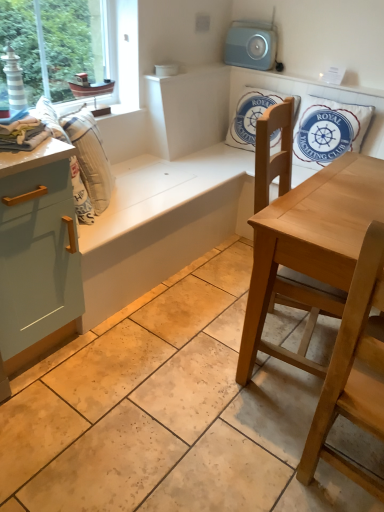
Question: Considering the relative positions of light wood chair at lower right, marked as the 1th chair in a front-to-back arrangement, and white striped fabric at left in the image provided, is light wood chair at lower right, marked as the 1th chair in a front-to-back arrangement, to the left of white striped fabric at left from the viewer's perspective?

Choices:
 (A) no
 (B) yes

Answer: (A)

Question: Does light wood chair at lower right, marked as the 1th chair in a front-to-back arrangement, have a lesser width compared to white striped fabric at left?

Choices:
 (A) no
 (B) yes

Answer: (A)

Question: Is there a large distance between light wood chair at lower right, marked as the 1th chair in a front-to-back arrangement, and white striped fabric at left?

Choices:
 (A) no
 (B) yes

Answer: (B)

Question: Considering the relative positions of light wood chair at lower right, acting as the 2th chair starting from the back, and white striped fabric at left in the image provided, is light wood chair at lower right, acting as the 2th chair starting from the back, to the right of white striped fabric at left from the viewer's perspective?

Choices:
 (A) no
 (B) yes

Answer: (B)

Question: Considering the relative sizes of light wood chair at lower right, marked as the 1th chair in a front-to-back arrangement, and white striped fabric at left in the image provided, is light wood chair at lower right, marked as the 1th chair in a front-to-back arrangement, bigger than white striped fabric at left?

Choices:
 (A) yes
 (B) no

Answer: (A)

Question: From a real-world perspective, is light wood chair at center, which is the first chair in back-to-front order, positioned above or below white cotton cushion at upper center, which ranks as the 2th pillow in right-to-left order?

Choices:
 (A) above
 (B) below

Answer: (B)

Question: Choose the correct answer: Is light wood chair at center, which is the first chair in back-to-front order, inside white cotton cushion at upper center, arranged as the first pillow when viewed from the left, or outside it?

Choices:
 (A) outside
 (B) inside

Answer: (A)

Question: Based on their positions, is light wood chair at center, which is the first chair in back-to-front order, located to the left or right of white cotton cushion at upper center, arranged as the first pillow when viewed from the left?

Choices:
 (A) right
 (B) left

Answer: (A)

Question: From the image's perspective, is light wood chair at center, marked as the 2th chair in a front-to-back arrangement, above or below white cotton cushion at upper center, arranged as the first pillow when viewed from the left?

Choices:
 (A) below
 (B) above

Answer: (A)

Question: From a real-world perspective, is light wood chair at lower right, acting as the 2th chair starting from the back, above or below white striped fabric at left?

Choices:
 (A) below
 (B) above

Answer: (A)

Question: Is light wood chair at lower right, acting as the 2th chair starting from the back, spatially inside white striped fabric at left, or outside of it?

Choices:
 (A) inside
 (B) outside

Answer: (B)

Question: Considering the positions of point (349, 379) and point (69, 120), is point (349, 379) closer or farther from the camera than point (69, 120)?

Choices:
 (A) closer
 (B) farther

Answer: (A)

Question: Is light wood chair at lower right, acting as the 2th chair starting from the back, wider or thinner than white striped fabric at left?

Choices:
 (A) wide
 (B) thin

Answer: (A)

Question: From a real-world perspective, is white cotton cushion at upper right, the 1th pillow viewed from the right, positioned above or below light blue matte cabinet at left?

Choices:
 (A) below
 (B) above

Answer: (B)

Question: Relative to light blue matte cabinet at left, is white cotton cushion at upper right, arranged as the second pillow when viewed from the left, in front or behind?

Choices:
 (A) behind
 (B) front

Answer: (A)